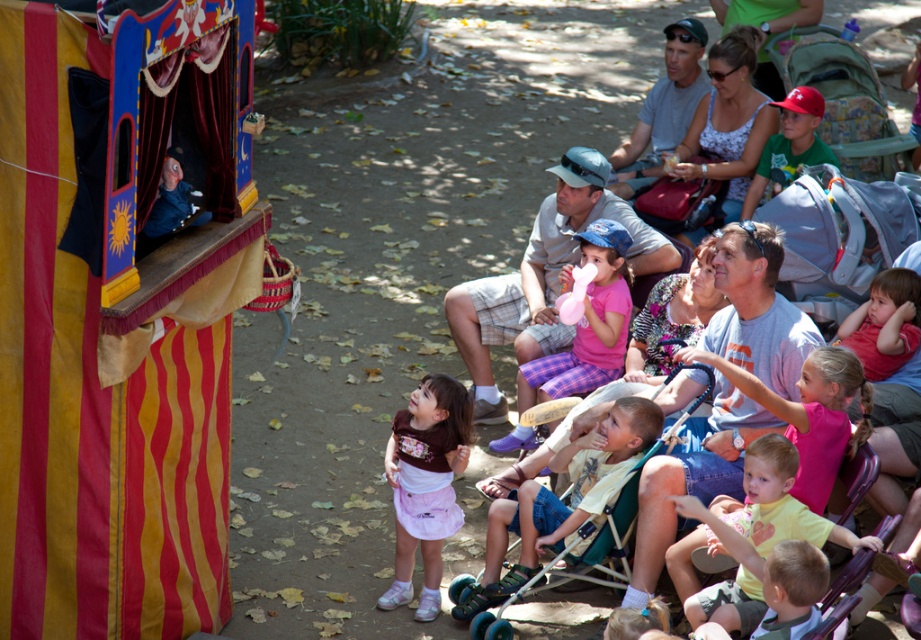
Question: Which point is closer to the camera?

Choices:
 (A) (481, 400)
 (B) (591, 248)
 (C) (689, 513)

Answer: (C)

Question: Among these objects, which one is nearest to the camera?

Choices:
 (A) light yellow sandal at lower center
 (B) pink fabric hat at center
 (C) pink fabric skirt at lower center

Answer: (C)

Question: Can you confirm if light yellow sandal at lower center is positioned to the right of pink fabric dress at center?

Choices:
 (A) no
 (B) yes

Answer: (A)

Question: Can you confirm if pink fabric hat at center is wider than light yellow sandal at lower center?

Choices:
 (A) yes
 (B) no

Answer: (A)

Question: Which point appears farthest from the camera in this image?

Choices:
 (A) (424, 497)
 (B) (625, 204)
 (C) (590, 340)

Answer: (B)

Question: Does light yellow sandal at lower center have a smaller size compared to yellow cotton shirt at lower right?

Choices:
 (A) yes
 (B) no

Answer: (B)